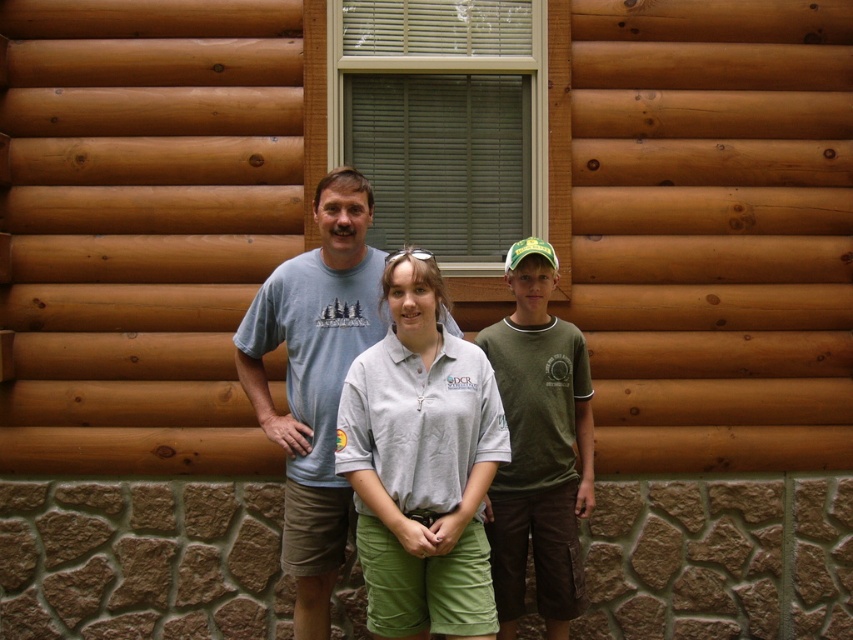
In the scene shown: Is gray cotton shirt at center smaller than green cotton shirt at center?

Yes, gray cotton shirt at center is smaller than green cotton shirt at center.

Does gray cotton shirt at center have a greater width compared to green cotton shirt at center?

Correct, the width of gray cotton shirt at center exceeds that of green cotton shirt at center.

Is point (407, 353) more distant than point (537, 432)?

No, it is not.

Where is `gray cotton shirt at center`? gray cotton shirt at center is located at coordinates (421, 465).

Consider the image. Which is more to the left, light blue t-shirt at center or green cotton shirt at center?

Positioned to the left is light blue t-shirt at center.

Is light blue t-shirt at center smaller than green cotton shirt at center?

Incorrect, light blue t-shirt at center is not smaller in size than green cotton shirt at center.

At what (x,y) coordinates should I click in order to perform the action: click on light blue t-shirt at center. Please return your answer as a coordinate pair (x, y). This screenshot has width=853, height=640. Looking at the image, I should click on (315, 380).

Between point (390, 364) and point (326, 502), which one is positioned in front?

Point (390, 364) is in front.

Is point (387, 628) more distant than point (323, 310)?

No, (387, 628) is in front of (323, 310).

Image resolution: width=853 pixels, height=640 pixels. Identify the location of gray cotton shirt at center. (421, 465).